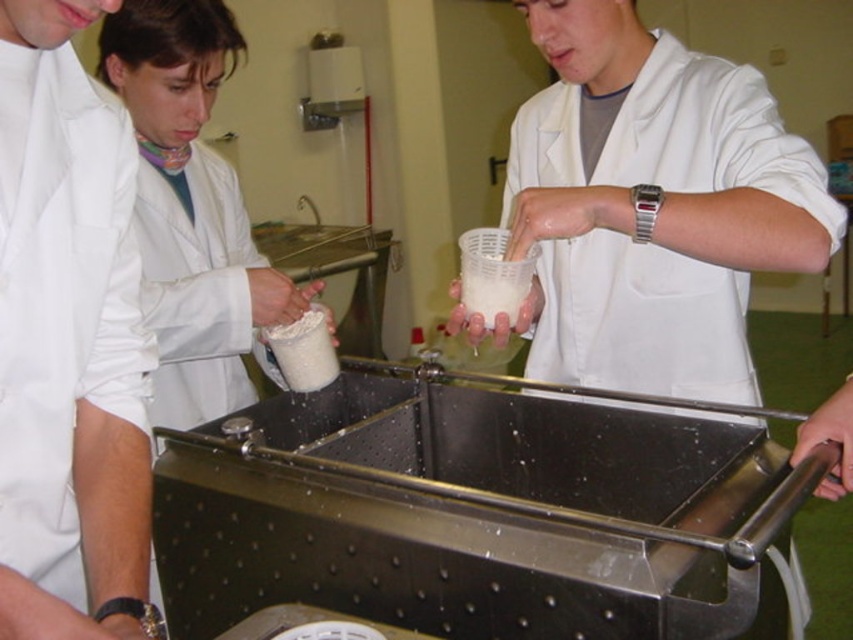
Consider the image. You are a student in the lab and need to choose a container to hold a chemical solution. The white matte plastic cup at center and the white matte lab coat at left are available. Which one has a larger capacity?

The white matte plastic cup at center is bigger than the white matte lab coat at left, so it has a larger capacity and is suitable for holding the chemical solution.